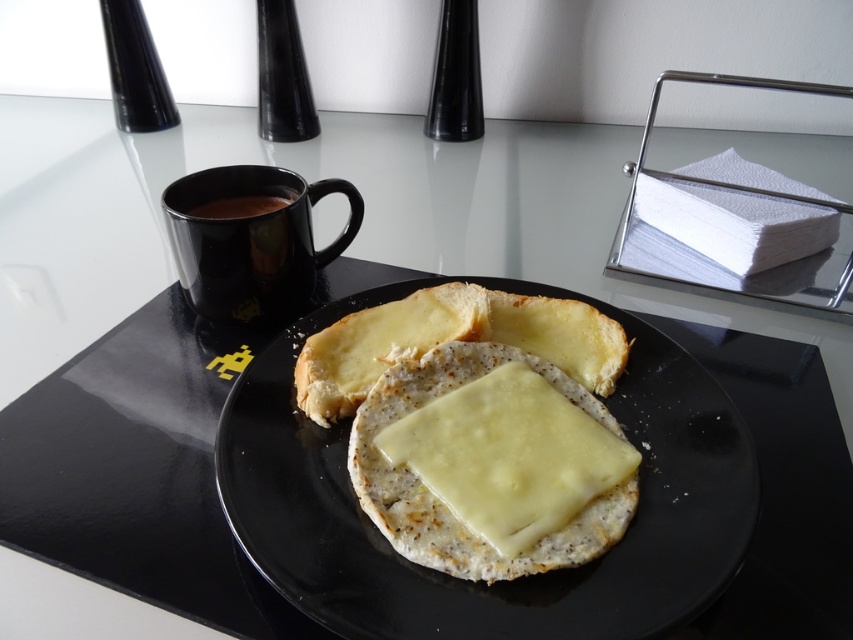
In the scene shown: You are setting up a breakfast table and want to place the black matte mug at left and the black glossy mug at upper left. According to the scene, which mug is positioned further to the left?

The black glossy mug at upper left is positioned further to the left because the black matte mug at left is to the right of it.

You are setting up a breakfast tray and need to place a napkin under the black matte mug at left. According to the image, where should you position the napkin relative to the mug?

The black matte mug at left is located at point (250, 241), so you should position the napkin directly under that coordinate to place it correctly.

You are standing in front of the breakfast table and want to reach for an item. If you extend your hand towards point A at coordinates point(503, 548) and point B at point(283, 205), which point will your hand reach first?

Point point(503, 548) is closer to the viewer than point point(283, 205), so your hand will reach point point(503, 548) first.